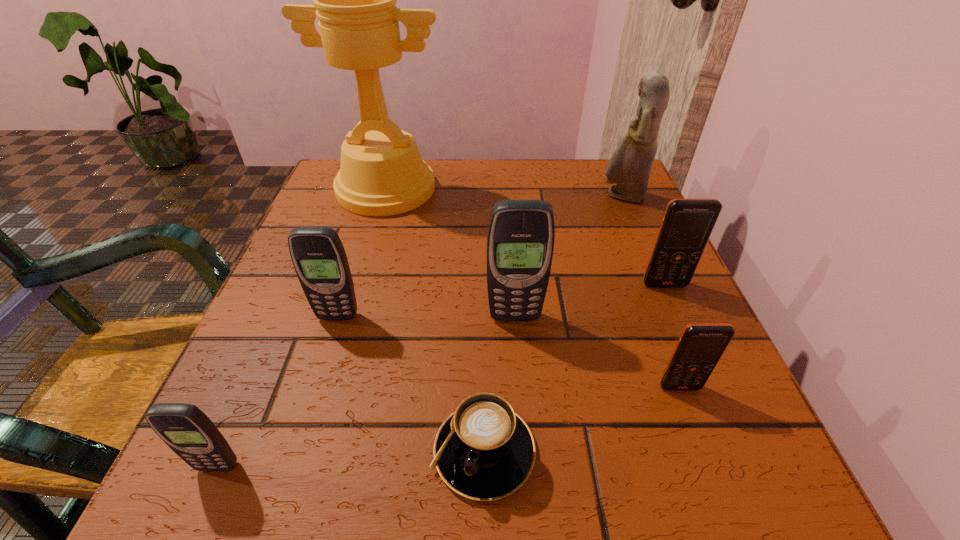
The height and width of the screenshot is (540, 960). I want to click on the second nearest cellular telephone, so click(x=701, y=345).

Identify the location of the leftmost gray cellular telephone. The width and height of the screenshot is (960, 540). (189, 432).

Find the location of `the leftmost cellular telephone`. the leftmost cellular telephone is located at coordinates (x=189, y=432).

The width and height of the screenshot is (960, 540). In order to click on the shortest object in this screenshot , I will do `click(484, 451)`.

Where is `cappuccino`? cappuccino is located at coordinates (484, 451).

Where is `vacant area situated 0.280m on the front of the tallest object`? The width and height of the screenshot is (960, 540). vacant area situated 0.280m on the front of the tallest object is located at coordinates (349, 314).

You are a GUI agent. You are given a task and a screenshot of the screen. Output one action in this format:
    pyautogui.click(x=<x>, y=<y>)
    Task: Click on the free space located on the front-facing side of the second tallest object
    
    Given the screenshot: What is the action you would take?
    pyautogui.click(x=547, y=197)

Where is `free space located on the front-facing side of the second tallest object`? This screenshot has height=540, width=960. free space located on the front-facing side of the second tallest object is located at coordinates (530, 197).

Find the location of a particular element. Image resolution: width=960 pixels, height=540 pixels. vacant position located 0.310m on the front-facing side of the second tallest object is located at coordinates (464, 197).

Where is `vacant space located on the screen of the rightmost gray cellular telephone`? vacant space located on the screen of the rightmost gray cellular telephone is located at coordinates (529, 509).